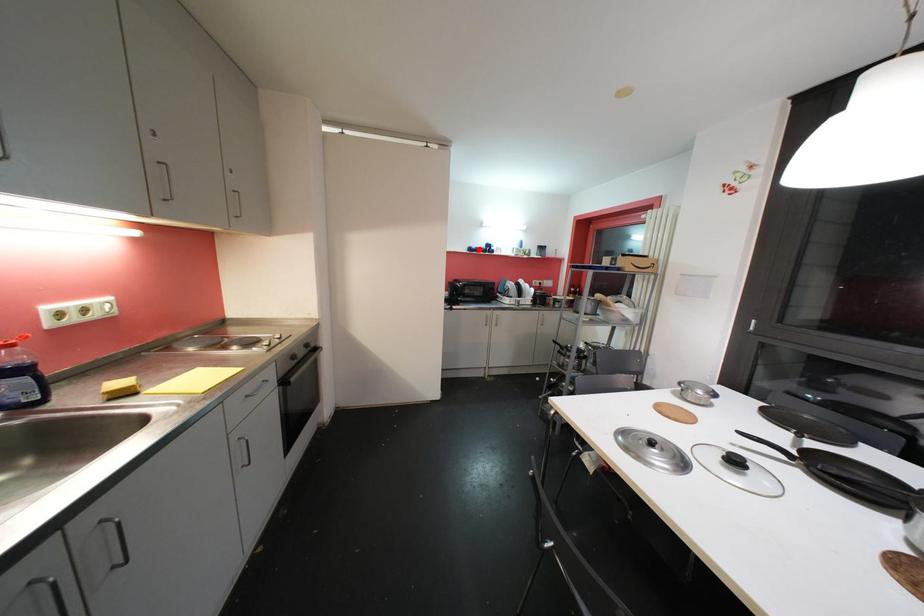
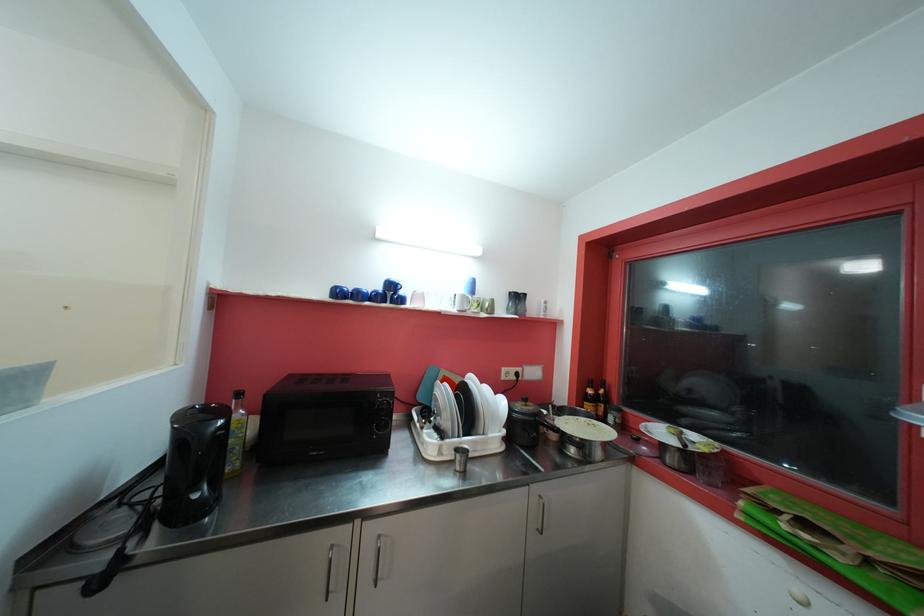
Where in the second image is the point corresponding to the highlighted location from the first image?

(354, 290)